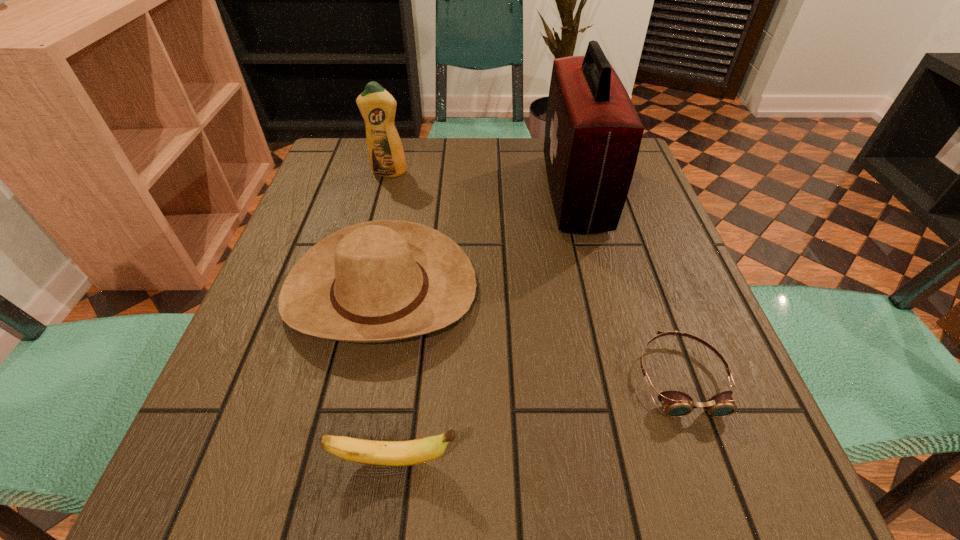
The width and height of the screenshot is (960, 540). What are the coordinates of `vacant space located on the front-facing side of the cowboy hat` in the screenshot? It's located at (359, 396).

Locate an element on the screen. Image resolution: width=960 pixels, height=540 pixels. vacant point located at the stem of the banana is located at coordinates (655, 461).

Find the location of a particular element. This screenshot has height=540, width=960. vacant region located through the lenses of the shortest object is located at coordinates (713, 467).

Image resolution: width=960 pixels, height=540 pixels. I want to click on the first aid kit located in the far edge section of the desktop, so click(593, 133).

What are the coordinates of `detergent at the far edge` in the screenshot? It's located at (377, 106).

Where is `object that is at the near edge`? This screenshot has height=540, width=960. object that is at the near edge is located at coordinates (412, 452).

Identify the location of detergent located at the left edge. The image size is (960, 540). (377, 106).

Identify the location of cowboy hat present at the left edge. (378, 281).

Where is `the first aid kit that is at the right edge`? Image resolution: width=960 pixels, height=540 pixels. the first aid kit that is at the right edge is located at coordinates (593, 133).

This screenshot has height=540, width=960. In order to click on goggles present at the right edge in this screenshot , I will do `click(676, 404)`.